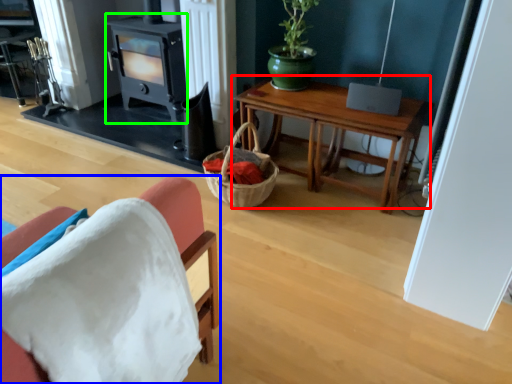
Question: Which object is the farthest from table (highlighted by a red box)? Choose among these: chair (highlighted by a blue box) or fireplace (highlighted by a green box).

Choices:
 (A) chair
 (B) fireplace

Answer: (A)